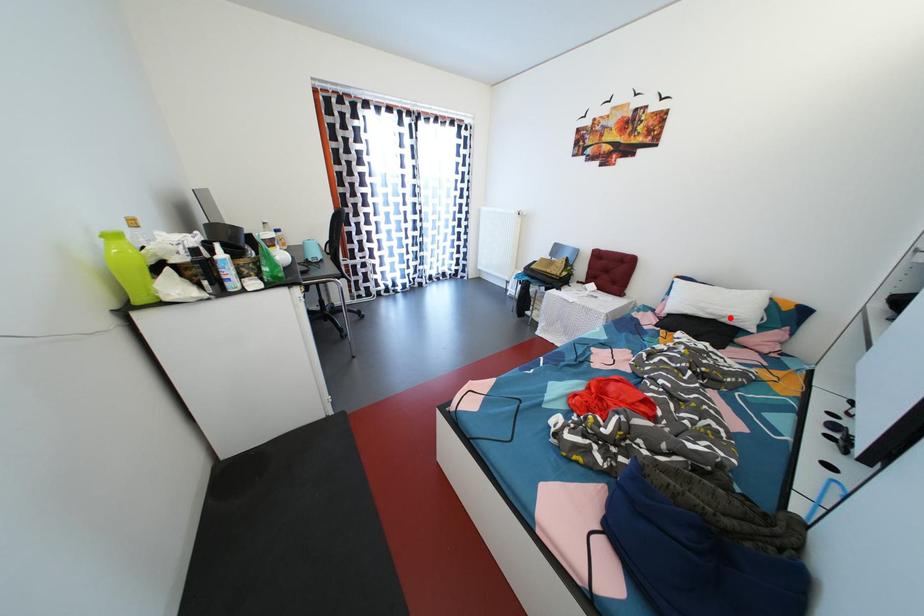
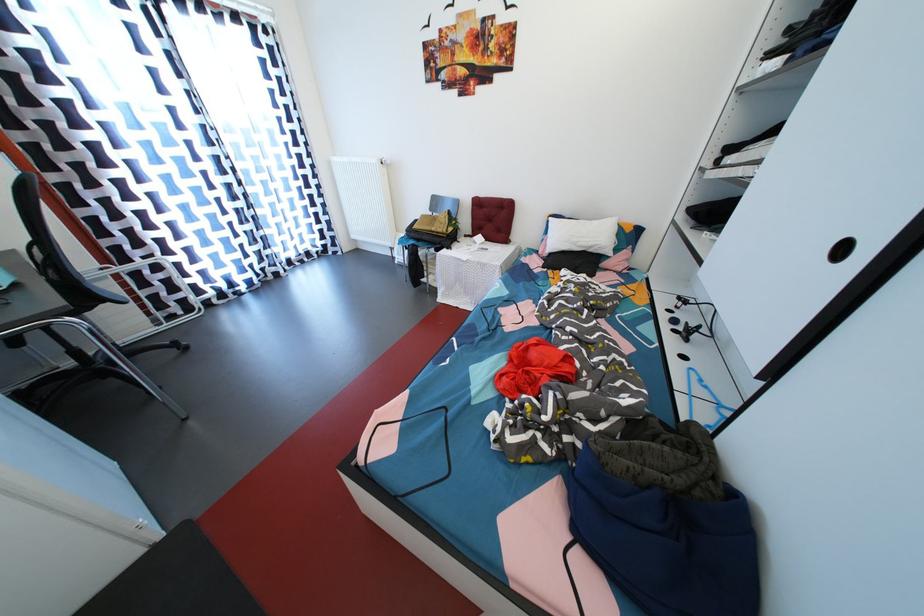
The point at the highlighted location is marked in the first image. Where is the corresponding point in the second image?

(597, 249)